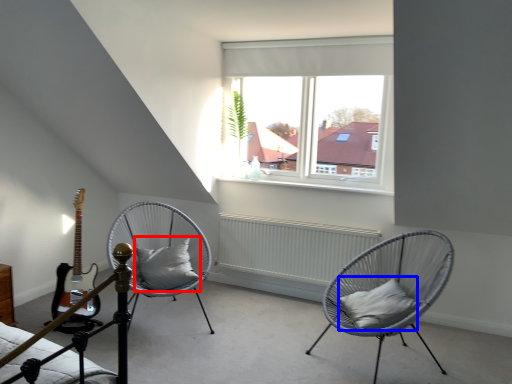
Question: Which object is further to the camera taking this photo, pillow (highlighted by a red box) or pillow (highlighted by a blue box)?

Choices:
 (A) pillow
 (B) pillow

Answer: (A)